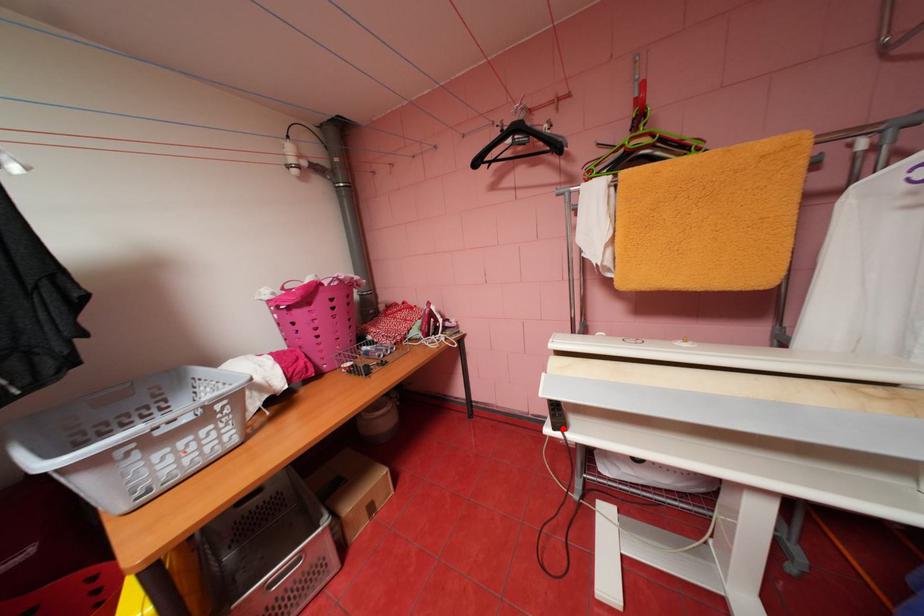
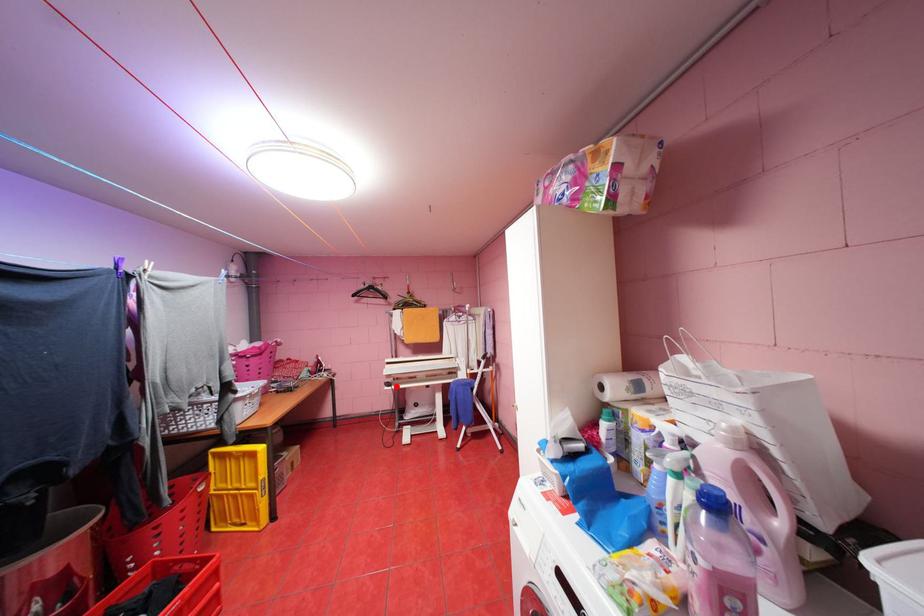
I am providing you with two images of the same scene from different viewpoints. A red point is marked on the first image and another point is marked on the second image. Is the marked point in image1 the same physical position as the marked point in image2?

Yes